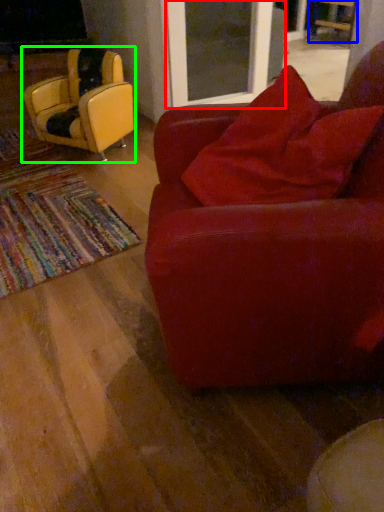
Question: Considering the real-world distances, which object is closest to screen door (highlighted by a red box)? chair (highlighted by a blue box) or chair (highlighted by a green box).

Choices:
 (A) chair
 (B) chair

Answer: (B)